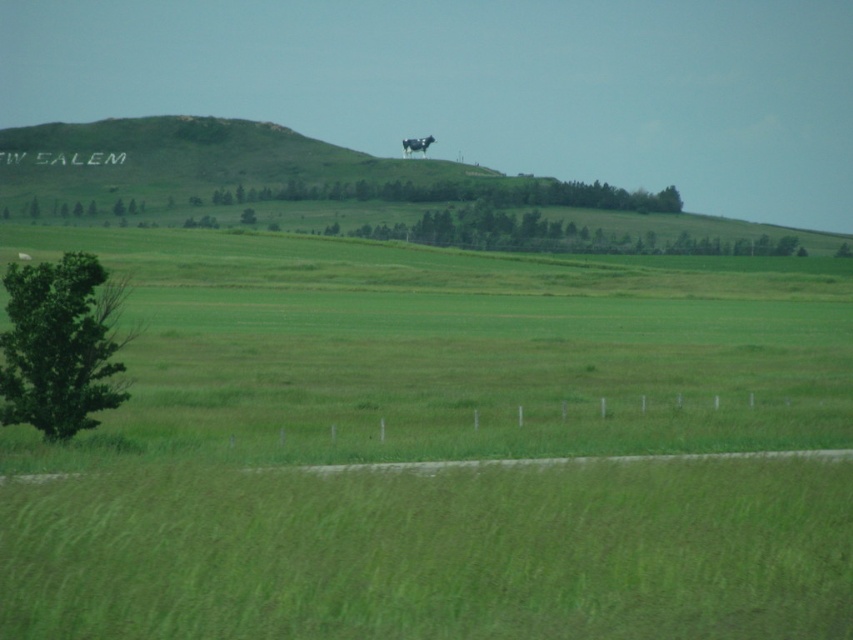
In the scene shown: You are planning to place a picnic blanket in the scene. The blanket requires 150 square meters of flat space. Given the distance between the green grassy hillside at upper center and the green leafy tree at lower left, can you determine if there is enough space between them for the picnic blanket?

The distance between the green grassy hillside at upper center and the green leafy tree at lower left is 170.60 meters. Since the required space is 150 square meters, the distance is sufficient to accommodate the picnic blanket.

You are standing on the green leafy tree at lower left and want to walk to the green grassy hillside at upper center. Which direction should you go?

You should walk upwards to reach the green grassy hillside at upper center since it is above the green leafy tree at lower left.

You are an artist planning to paint this rural landscape. You want to ensure the green grassy hillside at upper center and the green leafy tree at lower left are proportionally accurate. Which object should you make larger in your painting?

The green grassy hillside at upper center should be made larger in the painting since it is bigger than the green leafy tree at lower left according to the description.